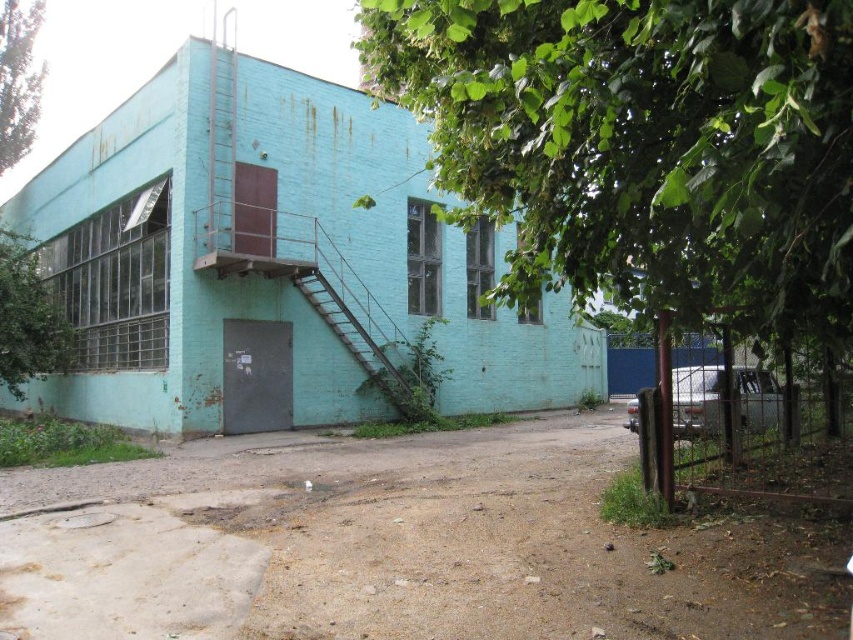
Based on the photo, is teal painted wall at upper left shorter than metallic teal car at right?

Incorrect, teal painted wall at upper left's height does not fall short of metallic teal car at right's.

Does teal painted wall at upper left have a larger size compared to metallic teal car at right?

Yes, teal painted wall at upper left is bigger than metallic teal car at right.

Where is `teal painted wall at upper left`? This screenshot has height=640, width=853. teal painted wall at upper left is located at coordinates (271, 260).